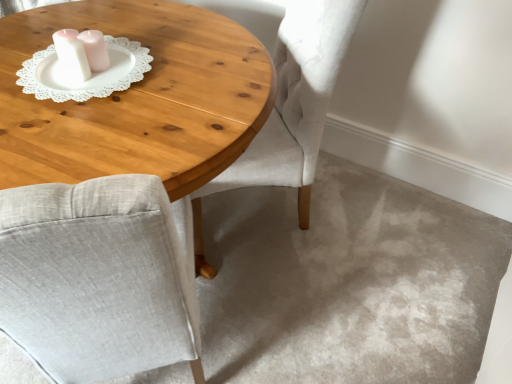
Locate an element on the screen. vacant area on top of wooden coffee table at center (from a real-world perspective) is located at coordinates (68, 76).